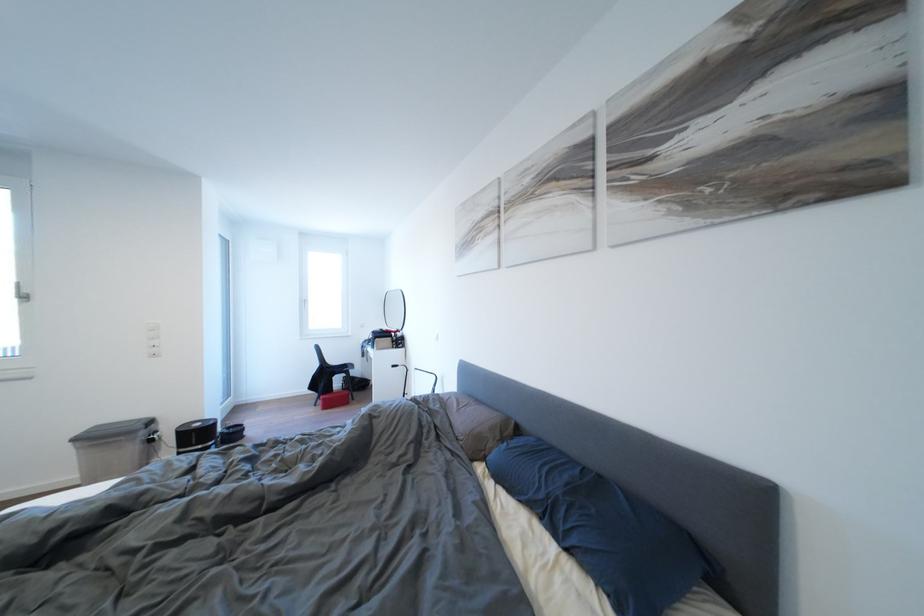
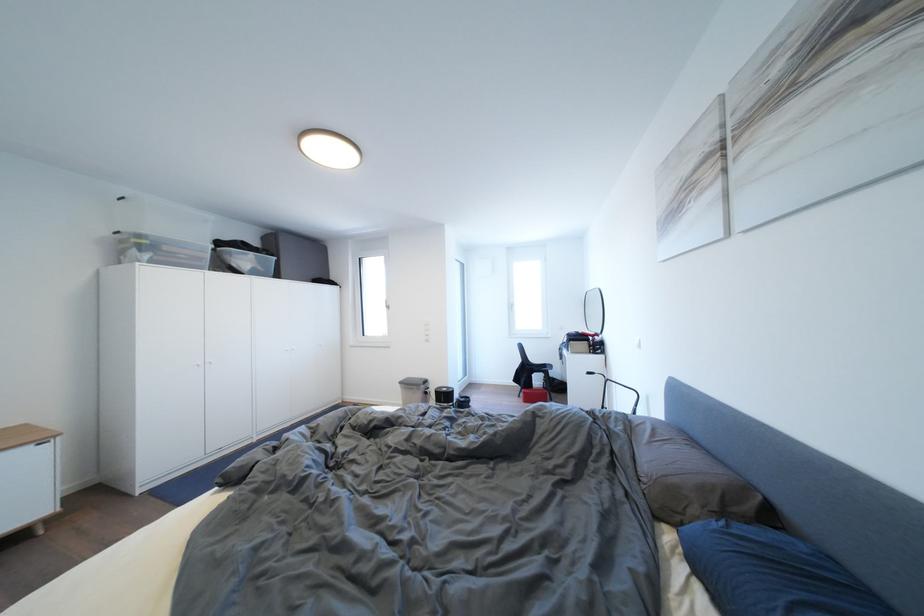
The point at (517, 496) is marked in the first image. Where is the corresponding point in the second image?

(726, 607)